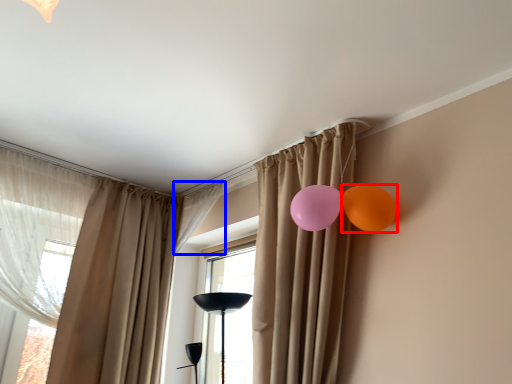
Question: Which of the following is the farthest to the observer, balloon (highlighted by a red box) or curtain (highlighted by a blue box)?

Choices:
 (A) balloon
 (B) curtain

Answer: (B)